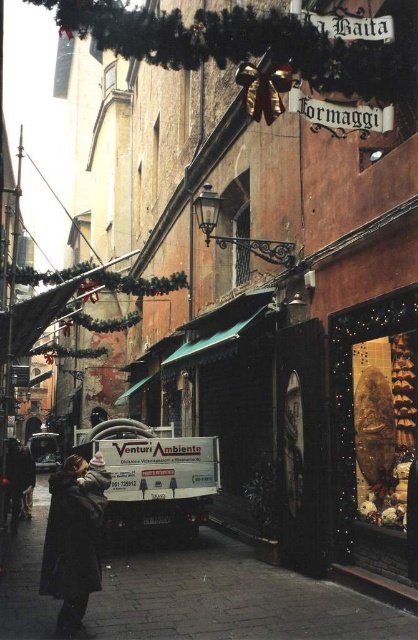
You are a pedestrian walking along the street and want to see the festive decorations on the cheese shop. The white matte van at center and dark brown coat at lower left are blocking your view. Which object is narrower and therefore easier to step around to get a better view?

The white matte van at center is thinner than dark brown coat at lower left, so it is narrower and easier to step around to get a better view.

You are a pedestrian standing on the narrow street and want to see the festive decorations on the Formaggi shop. The white matte van at center and dark brown coat at lower left are blocking your view. Which object is closer to you, making it harder to see the decorations?

The white matte van at center is located below dark brown coat at lower left, so the dark brown coat at lower left is closer to you, making it harder to see the decorations.